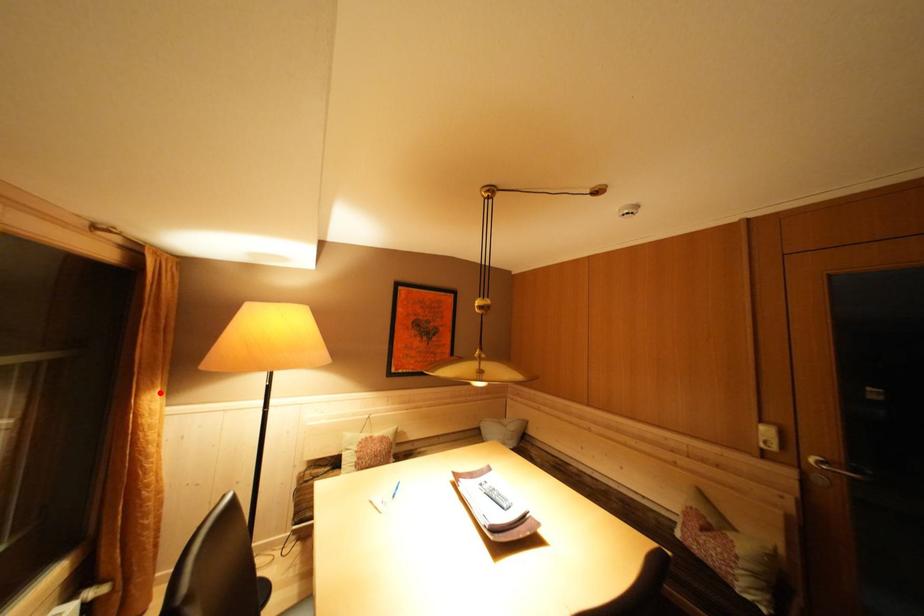
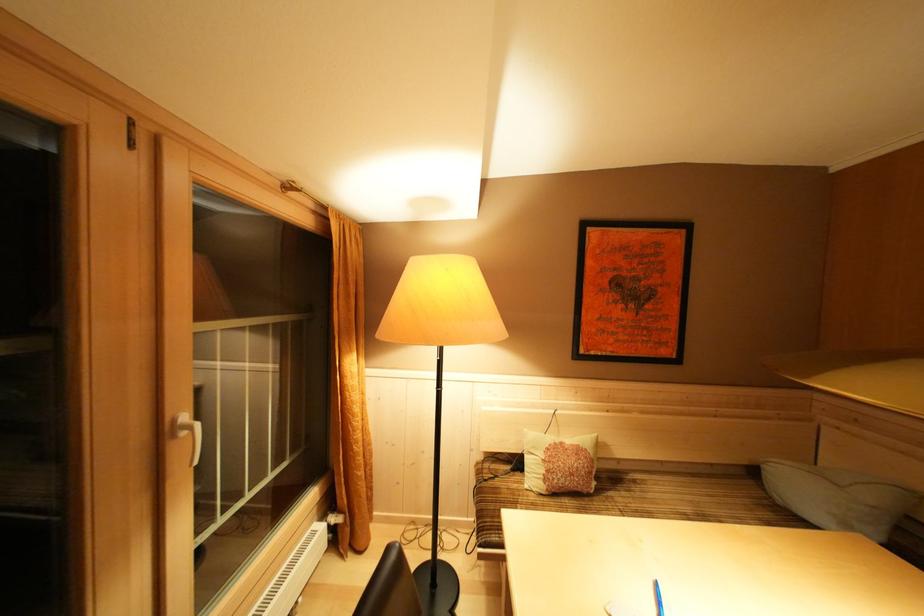
Find the pixel in the second image that matches the highlighted location in the first image.

(358, 357)